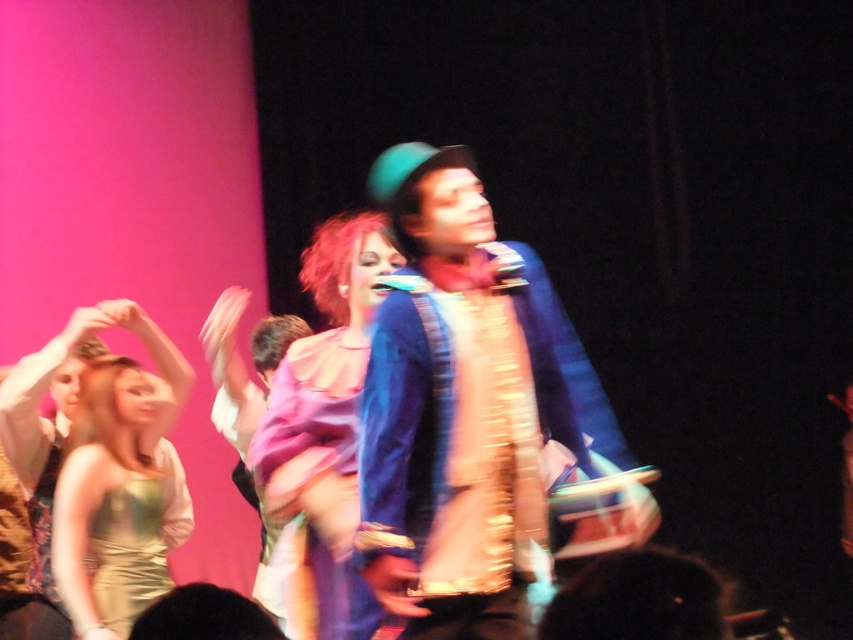
Can you confirm if matte pink dress at center is shorter than gold shiny dress at left?

Incorrect, matte pink dress at center's height does not fall short of gold shiny dress at left's.

Who is taller, matte pink dress at center or gold shiny dress at left?

matte pink dress at center is taller.

This screenshot has width=853, height=640. Identify the location of matte pink dress at center. (323, 428).

Find the location of a particular element. This screenshot has width=853, height=640. matte pink dress at center is located at coordinates (323, 428).

Is blue satin suit at center smaller than gold shiny dress at left?

Incorrect, blue satin suit at center is not smaller in size than gold shiny dress at left.

Locate an element on the screen. blue satin suit at center is located at coordinates (465, 408).

This screenshot has height=640, width=853. Describe the element at coordinates (465, 408) in the screenshot. I see `blue satin suit at center` at that location.

Where is `blue satin suit at center`? The image size is (853, 640). blue satin suit at center is located at coordinates (465, 408).

Is blue satin suit at center to the right of gold sequined dress at lower left from the viewer's perspective?

Yes, blue satin suit at center is to the right of gold sequined dress at lower left.

Describe the element at coordinates (465, 408) in the screenshot. The width and height of the screenshot is (853, 640). I see `blue satin suit at center` at that location.

You are a GUI agent. You are given a task and a screenshot of the screen. Output one action in this format:
    pyautogui.click(x=<x>, y=<y>)
    Task: Click on the blue satin suit at center
    The height and width of the screenshot is (640, 853).
    Given the screenshot: What is the action you would take?
    pyautogui.click(x=465, y=408)